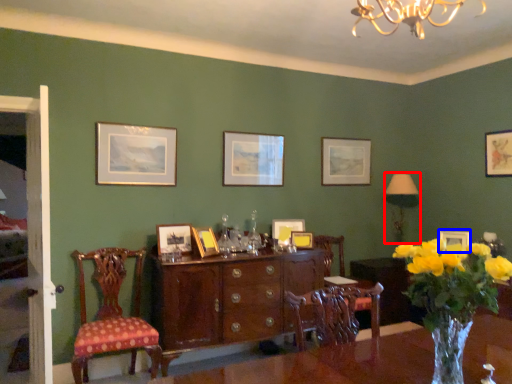
Question: Which of the following is the closest to the observer, lamp (highlighted by a red box) or picture frame (highlighted by a blue box)?

Choices:
 (A) lamp
 (B) picture frame

Answer: (B)